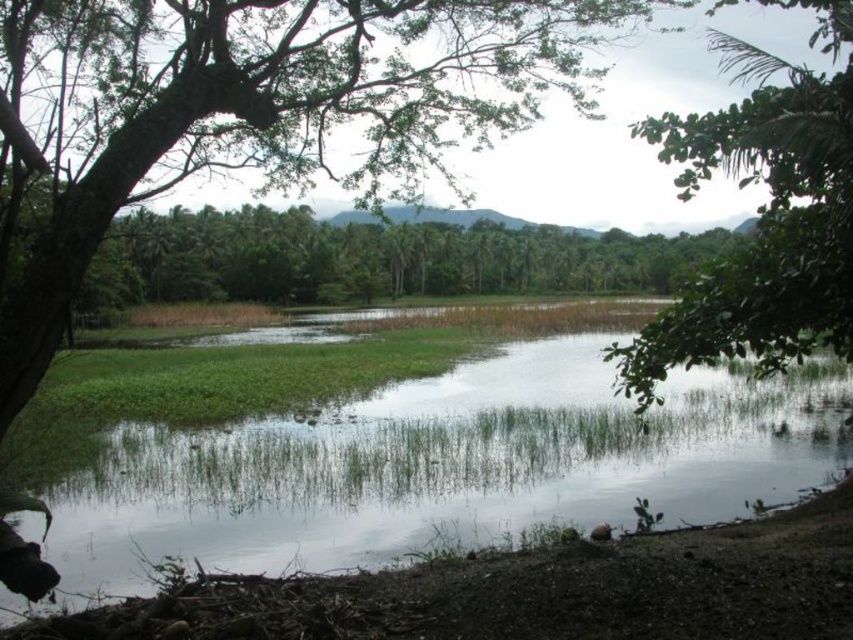
Question: Is green leafy tree at upper left positioned before green leafy tree at right?

Choices:
 (A) no
 (B) yes

Answer: (B)

Question: Which point is farther from the camera taking this photo?

Choices:
 (A) tap(466, 74)
 (B) tap(791, 205)

Answer: (A)

Question: Does green grassy creek at center appear over green leafy tree at right?

Choices:
 (A) no
 (B) yes

Answer: (A)

Question: Based on their relative distances, which object is nearer to the green grassy creek at center?

Choices:
 (A) green leafy tree at upper left
 (B) green leafy tree at right

Answer: (A)

Question: Is green leafy tree at upper left behind green leafy tree at right?

Choices:
 (A) no
 (B) yes

Answer: (A)

Question: Based on their relative distances, which object is nearer to the green grassy creek at center?

Choices:
 (A) green leafy tree at right
 (B) green leafy tree at upper left

Answer: (B)